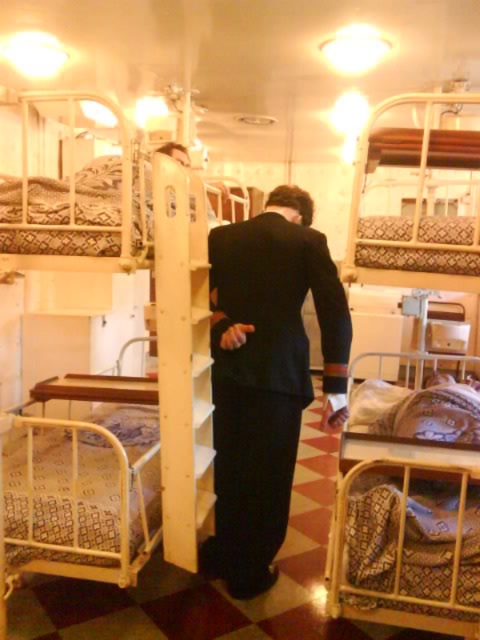
Question: Is black smooth suit at center smaller than patterned fabric bed at lower right?

Choices:
 (A) no
 (B) yes

Answer: (B)

Question: Can you confirm if black smooth suit at center is positioned below patterned fabric bed at lower right?

Choices:
 (A) yes
 (B) no

Answer: (B)

Question: Which object appears closest to the camera in this image?

Choices:
 (A) patterned fabric bed at lower right
 (B) black smooth suit at center

Answer: (A)

Question: Among these objects, which one is farthest from the camera?

Choices:
 (A) patterned fabric bed at lower right
 (B) black smooth suit at center

Answer: (B)

Question: Among these points, which one is nearest to the camera?

Choices:
 (A) (419, 484)
 (B) (252, 358)

Answer: (A)

Question: Is the position of black smooth suit at center less distant than that of patterned fabric bed at lower right?

Choices:
 (A) no
 (B) yes

Answer: (A)